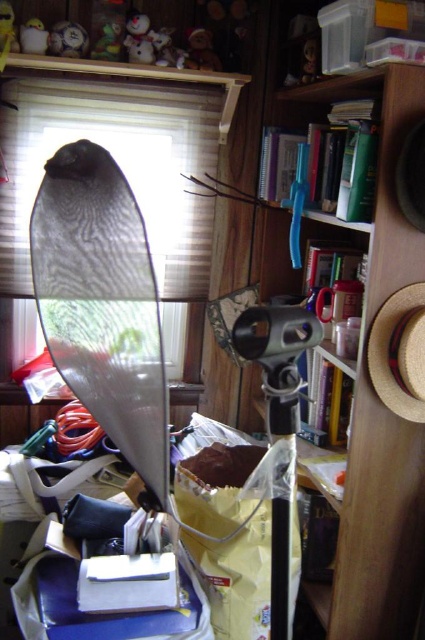
Is white plush toy at upper left behind plush teddy bear at upper center?

That is False.

The image size is (425, 640). Identify the location of white plush toy at upper left. (68, 38).

What are the coordinates of `white plush toy at upper left` in the screenshot? It's located at (68, 38).

Which of these two, white plush toy at upper left or white glossy snowman at upper left, stands shorter?

white plush toy at upper left

Which is in front, point (62, 40) or point (47, 40)?

Positioned in front is point (47, 40).

Is point (65, 52) farther from viewer compared to point (20, 51)?

That is True.

Identify the location of white plush toy at upper left. The height and width of the screenshot is (640, 425). (68, 38).

Consider the image. Does wooden bookshelf at upper center have a greater width compared to wooden snowman at upper center?

Yes.

Locate an element on the screen. This screenshot has width=425, height=640. wooden bookshelf at upper center is located at coordinates (374, 394).